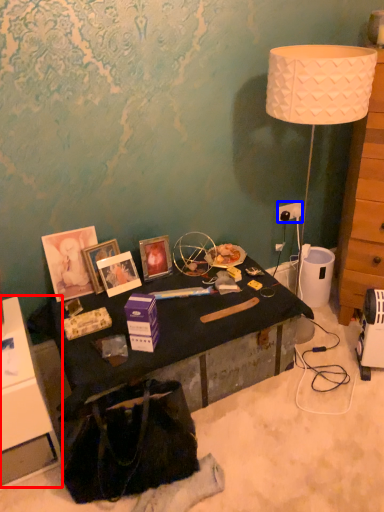
Question: Which point is closer to the camera, cabinetry (highlighted by a red box) or power outlet (highlighted by a blue box)?

Choices:
 (A) cabinetry
 (B) power outlet

Answer: (A)